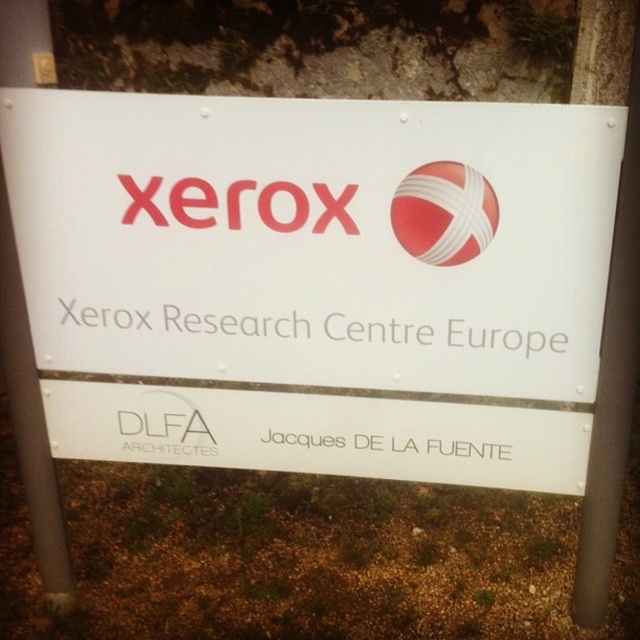
You are standing in front of the signboard and want to touch both the white plastic pole at center and the red glossy sphere at center. Which object should you reach for first if you want to touch the larger one first?

The white plastic pole at center is bigger than the red glossy sphere at center, so you should reach for the white plastic pole at center first.

You are standing in front of the signboard and want to touch both the red glossy sphere at center and the matte red xerox logo at center. Which one do you need to reach higher to touch?

The red glossy sphere at center is taller than the matte red xerox logo at center, so you need to reach higher to touch the red glossy sphere at center.